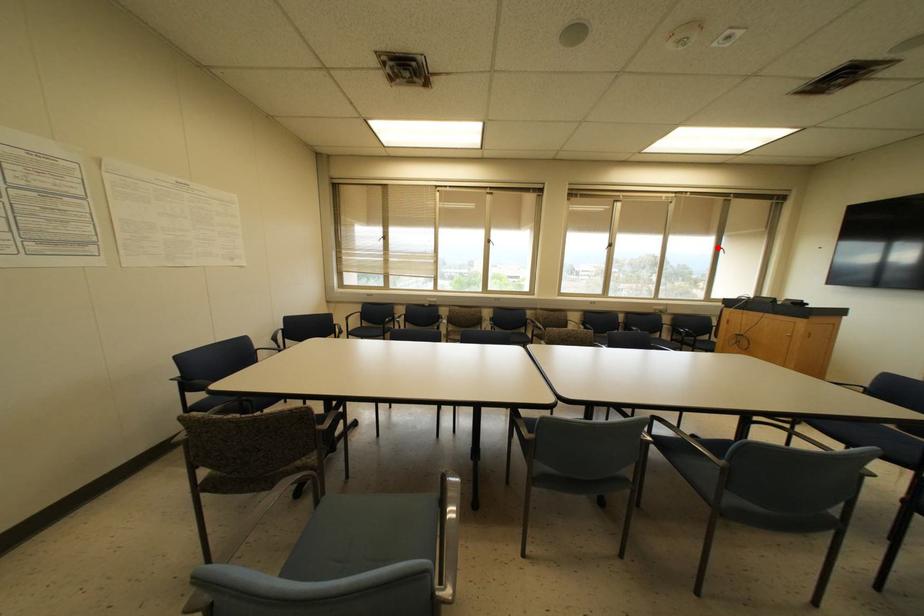
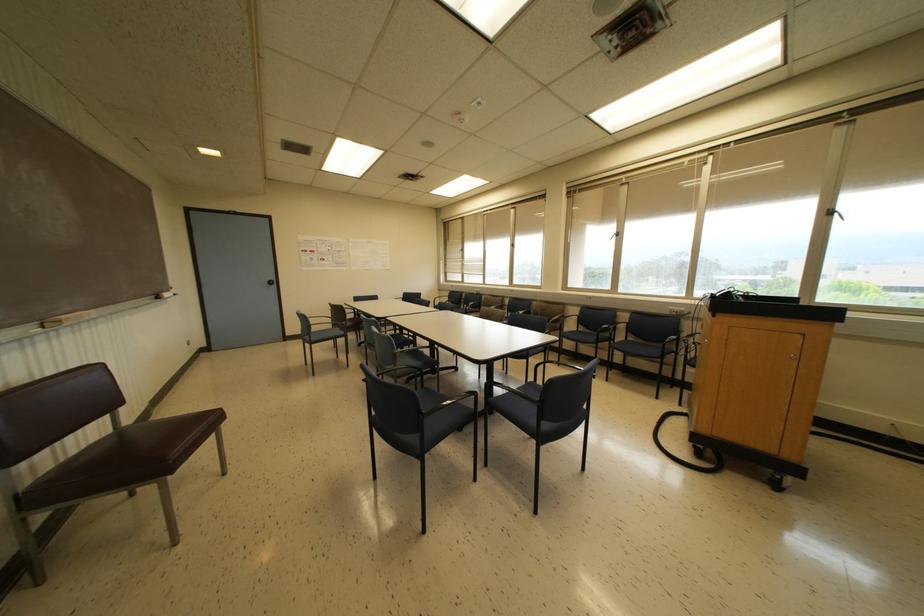
In the second image, find the point that corresponds to the highlighted location in the first image.

(827, 213)